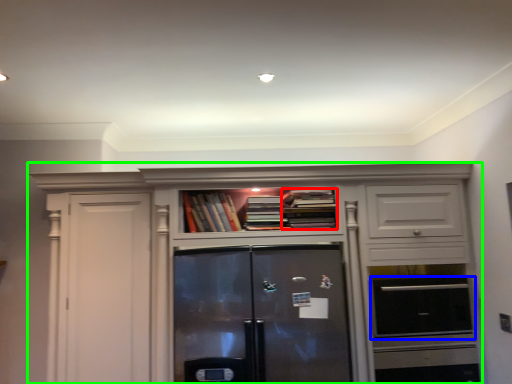
Question: Estimate the real-world distances between objects in this image. Which object is farther from book (highlighted by a red box), appliance (highlighted by a blue box) or cabinetry (highlighted by a green box)?

Choices:
 (A) appliance
 (B) cabinetry

Answer: (A)